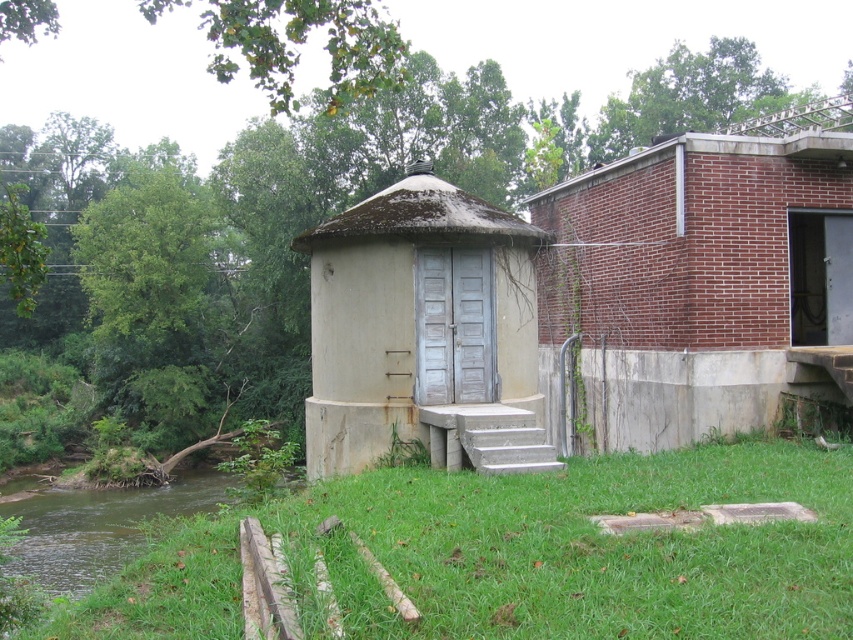
You are a painter who needs to know which object, the brick wall at right or the light gray concrete hut at center, has a greater width to decide which one to paint first. Based on the scene, can you determine which is wider?

The brick wall at right is wider than the light gray concrete hut at center according to the description.

You are standing at the point marked by the coordinates point (699,282) in the rural scene. Which structure are you touching? The small cylindrical structure with a conical roof or the larger brick building at the right?

The point (699,282) is on the brick wall at right, so you are touching the larger brick building at the right.